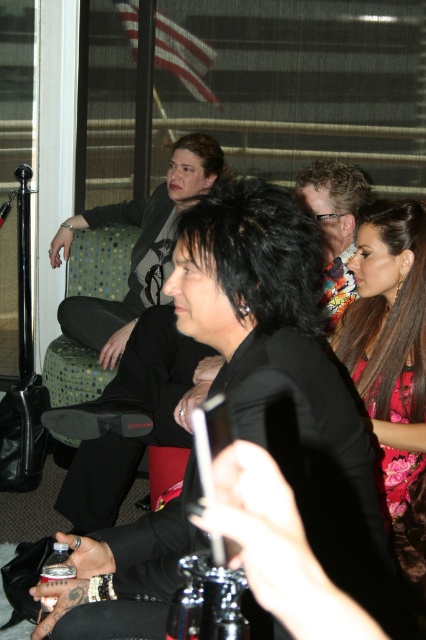
Question: Which point appears closest to the camera in this image?

Choices:
 (A) (57, 637)
 (B) (65, 566)
 (C) (334, 164)
 (D) (183, 134)

Answer: (A)

Question: Does floral fabric dress at center have a smaller size compared to matte black jacket at upper left?

Choices:
 (A) yes
 (B) no

Answer: (A)

Question: Among these points, which one is nearest to the camera?

Choices:
 (A) [126, 332]
 (B) [155, 544]

Answer: (B)

Question: Can you confirm if floral fabric dress at center is bigger than matte black jacket at upper left?

Choices:
 (A) yes
 (B) no

Answer: (B)

Question: Can you confirm if floral fabric dress at center is smaller than metallic silver can at lower left?

Choices:
 (A) yes
 (B) no

Answer: (A)

Question: Which object appears closest to the camera in this image?

Choices:
 (A) black satin jacket at center
 (B) floral fabric dress at center
 (C) matte black jacket at upper left
 (D) metallic silver can at lower left

Answer: (A)